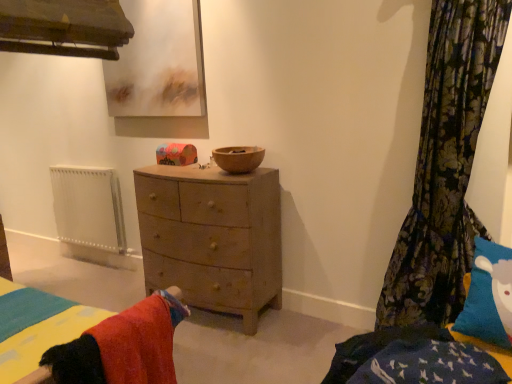
Question: Is floral fabric curtain at right positioned before wooden bowl at center?

Choices:
 (A) yes
 (B) no

Answer: (A)

Question: Is floral fabric curtain at right at the left side of wooden bowl at center?

Choices:
 (A) yes
 (B) no

Answer: (B)

Question: From the image's perspective, does floral fabric curtain at right appear lower than wooden bowl at center?

Choices:
 (A) yes
 (B) no

Answer: (A)

Question: Could you tell me if floral fabric curtain at right is facing wooden bowl at center?

Choices:
 (A) yes
 (B) no

Answer: (B)

Question: From a real-world perspective, is floral fabric curtain at right over wooden bowl at center?

Choices:
 (A) no
 (B) yes

Answer: (A)

Question: Relative to floral fabric curtain at right, is matte wooden picture frame at upper center in front or behind?

Choices:
 (A) behind
 (B) front

Answer: (A)

Question: Is matte wooden picture frame at upper center spatially inside floral fabric curtain at right, or outside of it?

Choices:
 (A) inside
 (B) outside

Answer: (B)

Question: Considering the positions of matte wooden picture frame at upper center and floral fabric curtain at right in the image, is matte wooden picture frame at upper center taller or shorter than floral fabric curtain at right?

Choices:
 (A) tall
 (B) short

Answer: (B)

Question: Is matte wooden picture frame at upper center wider or thinner than floral fabric curtain at right?

Choices:
 (A) wide
 (B) thin

Answer: (B)

Question: Considering the positions of white metallic radiator at left and wooden bowl at center in the image, is white metallic radiator at left wider or thinner than wooden bowl at center?

Choices:
 (A) thin
 (B) wide

Answer: (A)

Question: Looking at the image, does white metallic radiator at left seem bigger or smaller compared to wooden bowl at center?

Choices:
 (A) big
 (B) small

Answer: (A)

Question: Would you say white metallic radiator at left is inside or outside wooden bowl at center?

Choices:
 (A) outside
 (B) inside

Answer: (A)

Question: Is point (118, 210) closer or farther from the camera than point (228, 157)?

Choices:
 (A) closer
 (B) farther

Answer: (B)

Question: From a real-world perspective, is floral fabric curtain at right above or below white metallic radiator at left?

Choices:
 (A) above
 (B) below

Answer: (A)

Question: Looking at the image, does floral fabric curtain at right seem bigger or smaller compared to white metallic radiator at left?

Choices:
 (A) small
 (B) big

Answer: (B)